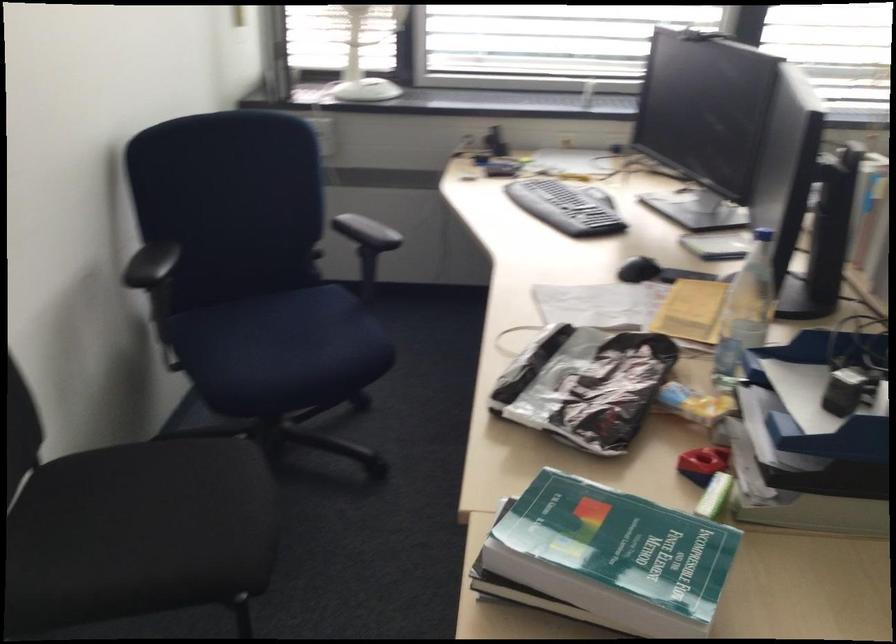
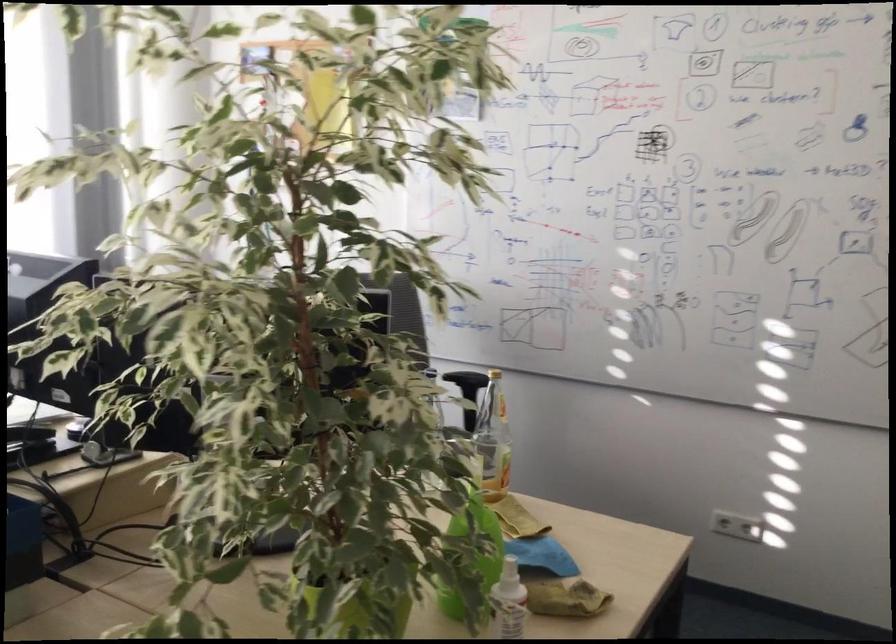
Question: The camera is either moving clockwise (left) or counter-clockwise (right) around the object. The first image is from the beginning of the video and the second image is from the end. Is the camera moving left or right when shooting the video?

Choices:
 (A) Left
 (B) Right

Answer: (A)